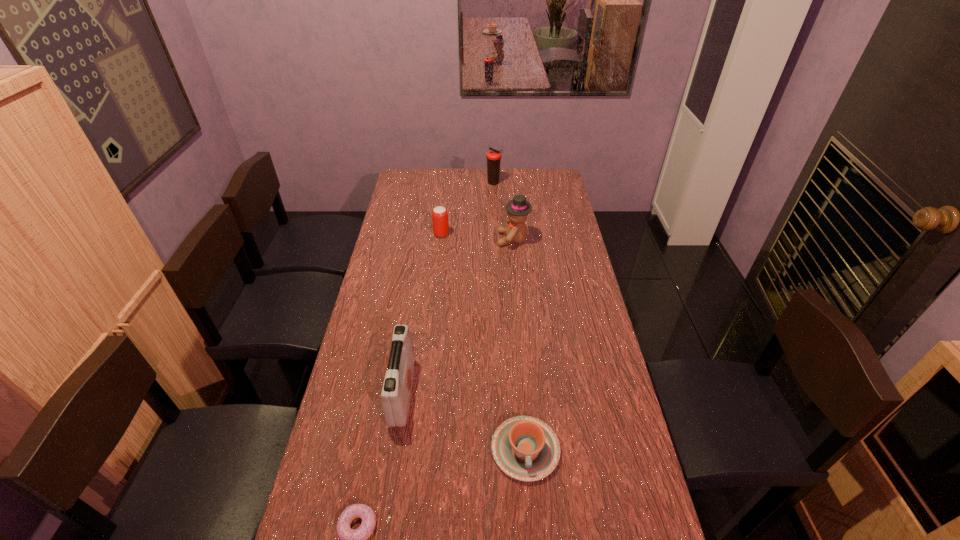
Image resolution: width=960 pixels, height=540 pixels. What are the coordinates of `vacant space that satisfies the following two spatial constraints: 1. on the front-facing side of the rag_doll; 2. on the handle side of the chinaware` in the screenshot? It's located at (532, 450).

Locate an element on the screen. This screenshot has width=960, height=540. free location that satisfies the following two spatial constraints: 1. on the front-facing side of the rag_doll; 2. on the handle side of the chinaware is located at coordinates (532, 450).